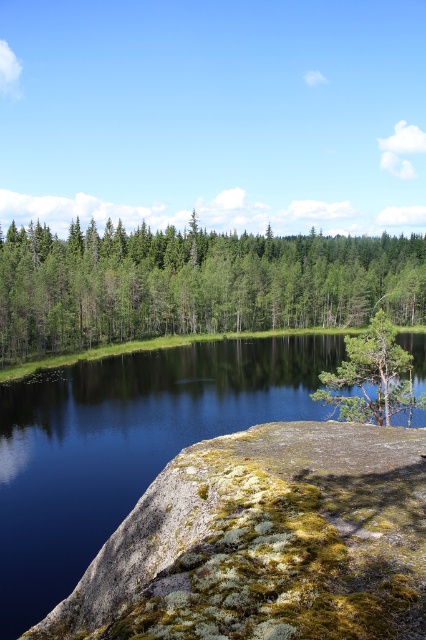
Who is shorter, smooth dark water at center or green textured tree at center?

Standing shorter between the two is smooth dark water at center.

Who is higher up, smooth dark water at center or green textured tree at center?

green textured tree at center is higher up.

Is point (45, 492) behind point (14, 241)?

No, it is not.

You are a GUI agent. You are given a task and a screenshot of the screen. Output one action in this format:
    pyautogui.click(x=<x>, y=<y>)
    Task: Click on the smooth dark water at center
    The height and width of the screenshot is (640, 426).
    Given the screenshot: What is the action you would take?
    pyautogui.click(x=123, y=445)

Is smooth dark water at center taller than green matte tree at center?

Indeed, smooth dark water at center has a greater height compared to green matte tree at center.

Who is more forward, (37, 492) or (376, 339)?

Point (37, 492) is more forward.

Where is `smooth dark water at center`? This screenshot has height=640, width=426. smooth dark water at center is located at coordinates (123, 445).

Is green textured tree at center above green matte tree at center?

Yes.

Is green textured tree at center thinner than green matte tree at center?

No.

Between point (353, 291) and point (348, 403), which one is positioned behind?

Positioned behind is point (353, 291).

This screenshot has width=426, height=640. I want to click on green textured tree at center, so point(193,284).